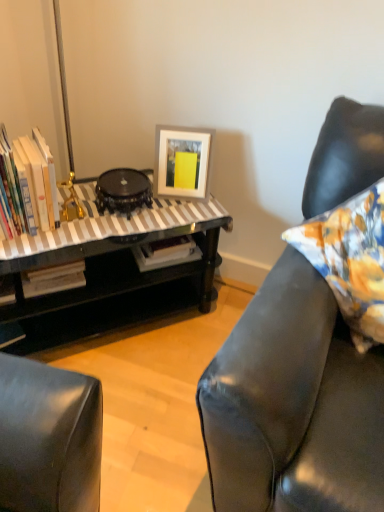
Find the location of a particular element. vacant space in black glossy round table at center (from a real-world perspective) is located at coordinates (136, 210).